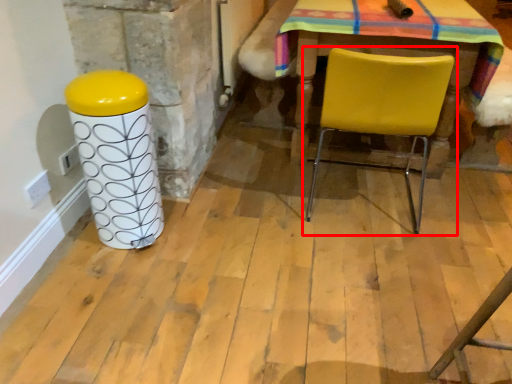
Question: From the image's perspective, considering the relative positions of chair (annotated by the red box) and pillar in the image provided, where is chair (annotated by the red box) located with respect to the staircase?

Choices:
 (A) below
 (B) above

Answer: (B)